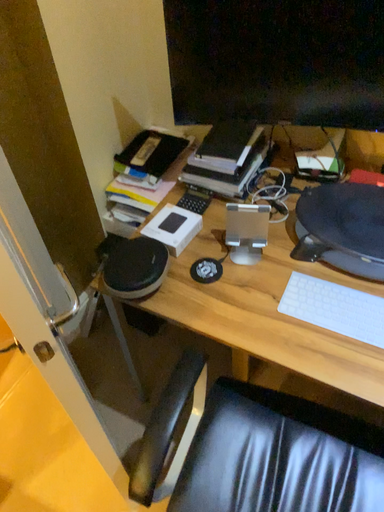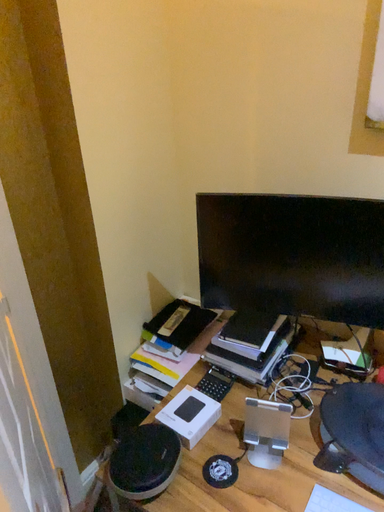
Question: How did the camera likely rotate when shooting the video?

Choices:
 (A) rotated upward
 (B) rotated downward

Answer: (A)